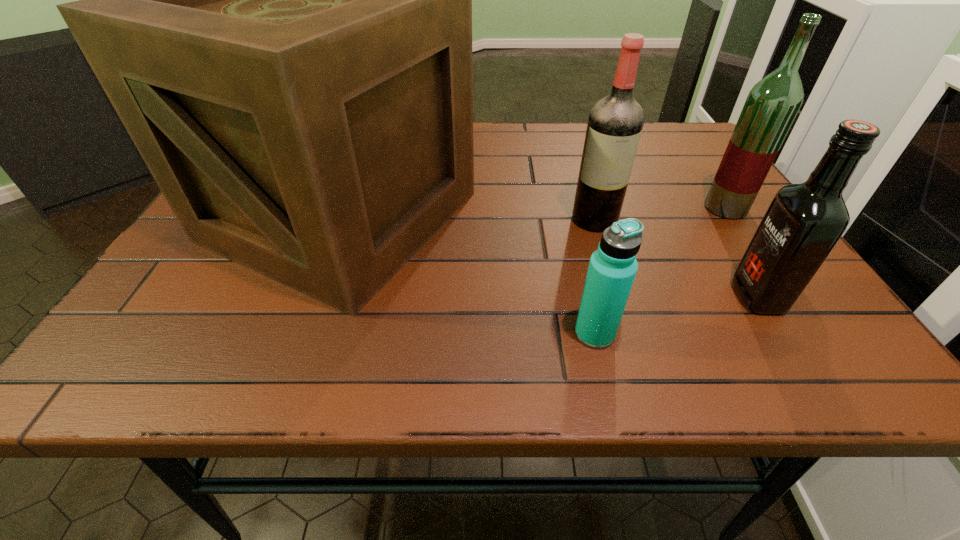
Locate an element on the screen. the second closest liquor to the leftmost liquor is located at coordinates (803, 223).

You are a GUI agent. You are given a task and a screenshot of the screen. Output one action in this format:
    pyautogui.click(x=<x>, y=<y>)
    Task: Click on the second closest liquor to the leftmost liquor
    
    Given the screenshot: What is the action you would take?
    pyautogui.click(x=803, y=223)

Locate an element on the screen. This screenshot has height=540, width=960. vacant space that satisfies the following two spatial constraints: 1. on the front side of the box; 2. on the right side of the water bottle is located at coordinates (297, 334).